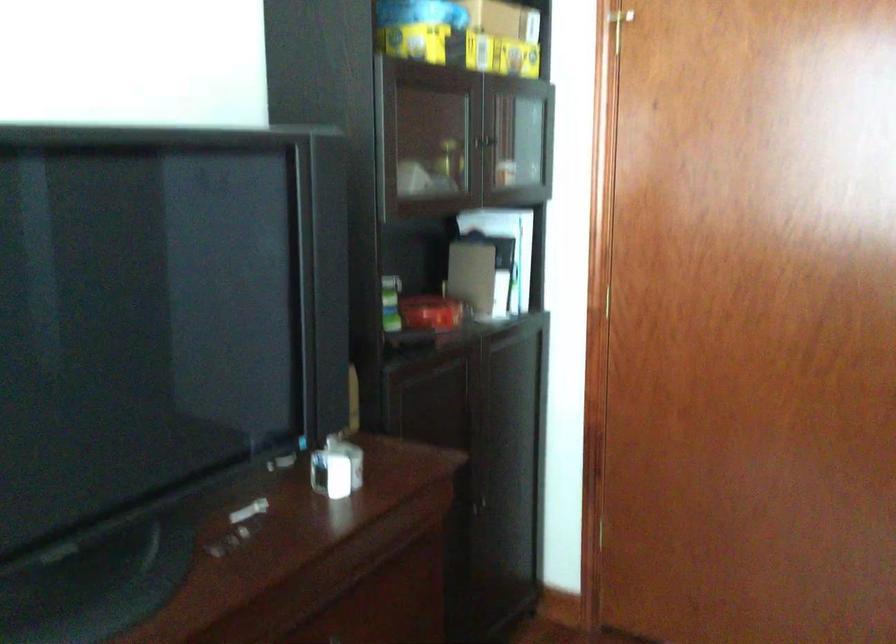
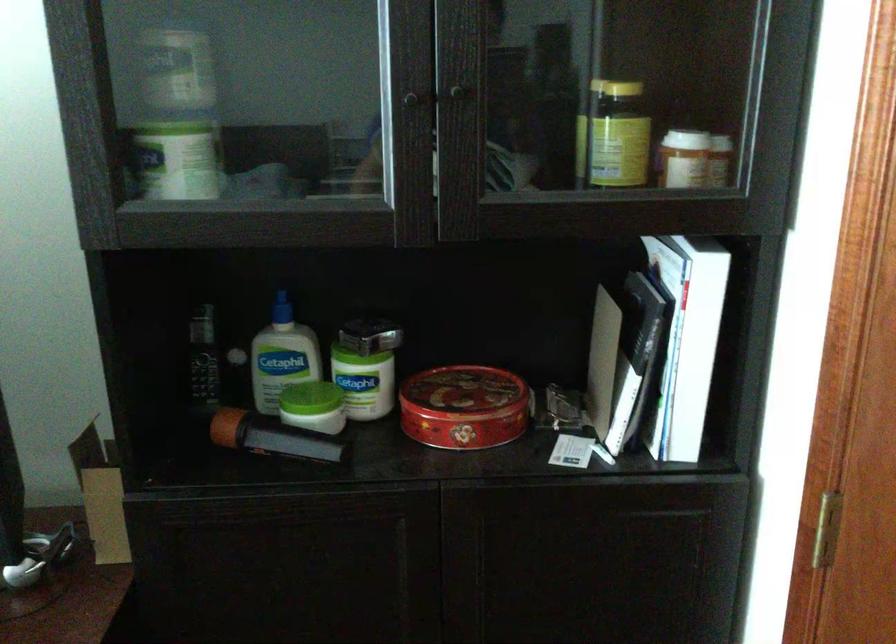
Question: I am providing you with two images of the same scene from different viewpoints. Please identify which objects are invisible in image2.

Choices:
 (A) cordless phone handset
 (B) white bottle cap
 (C) green jar lid
 (D) none of these

Answer: (D)